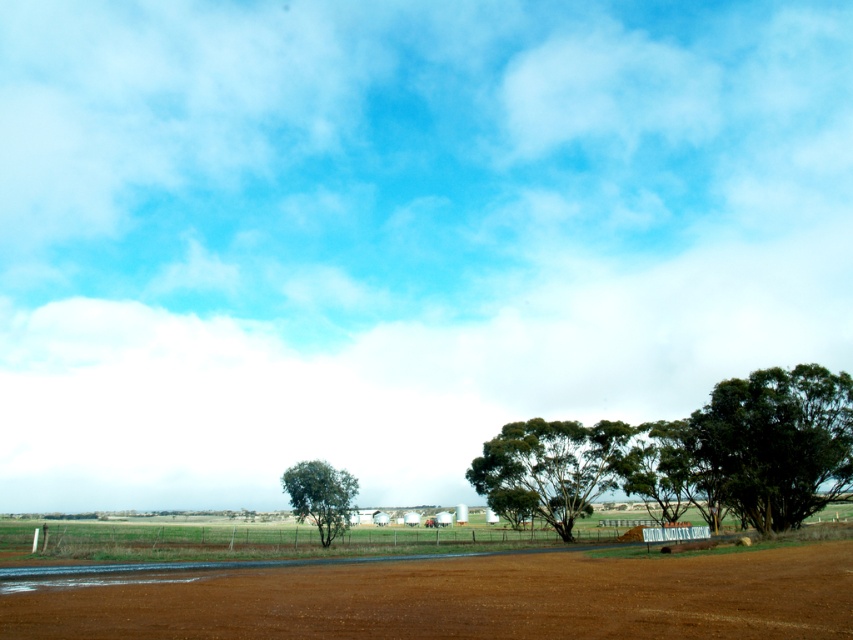
Question: Which of the following is the farthest from the observer?

Choices:
 (A) (328, 464)
 (B) (747, 424)
 (C) (618, 458)

Answer: (C)

Question: Does brown dirt field at center appear over green leafy tree at center?

Choices:
 (A) no
 (B) yes

Answer: (B)

Question: Is brown dirt field at center above green leafy tree at right?

Choices:
 (A) yes
 (B) no

Answer: (A)

Question: Which object is the farthest from the green leafy tree at lower left?

Choices:
 (A) green leafy tree at center
 (B) brown dirt field at center
 (C) green leafy tree at right

Answer: (C)

Question: Which of the following is the farthest from the observer?

Choices:
 (A) green leafy tree at lower left
 (B) brown dirt field at center
 (C) green leafy tree at center
 (D) green leafy tree at right

Answer: (C)

Question: Can you confirm if brown dirt field at center is positioned to the left of green leafy tree at right?

Choices:
 (A) no
 (B) yes

Answer: (B)